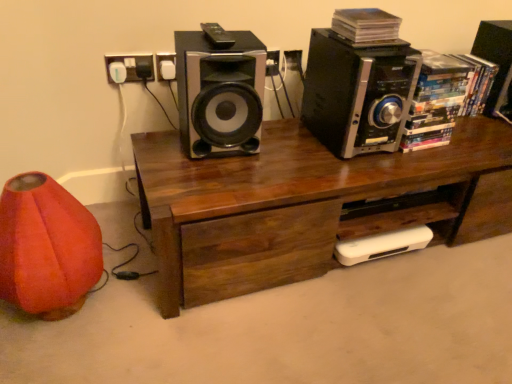
Question: From the image's perspective, is orange fabric bean bag chair at lower left above or below wooden desk at center?

Choices:
 (A) above
 (B) below

Answer: (B)

Question: In terms of height, does orange fabric bean bag chair at lower left look taller or shorter compared to wooden desk at center?

Choices:
 (A) tall
 (B) short

Answer: (A)

Question: Considering the real-world distances, which object is closest to the metallic silver speaker at center, which ranks as the 3th speaker in right-to-left order?

Choices:
 (A) wooden desk at center
 (B) black metallic speaker at upper right, which is counted as the second speaker, starting from the left
 (C) white plastic socket at upper left
 (D) black plastic speaker at upper right, which is the third speaker in left-to-right order
 (E) black plastic remote control at upper center

Answer: (E)

Question: Considering the real-world distances, which object is farthest from the metallic silver speaker at center, which is counted as the 1th speaker, starting from the left?

Choices:
 (A) black metallic speaker at upper right, acting as the 2th speaker starting from the right
 (B) black plastic speaker at upper right, which is the third speaker in left-to-right order
 (C) orange fabric bean bag chair at lower left
 (D) wooden desk at center
 (E) black plastic remote control at upper center

Answer: (B)